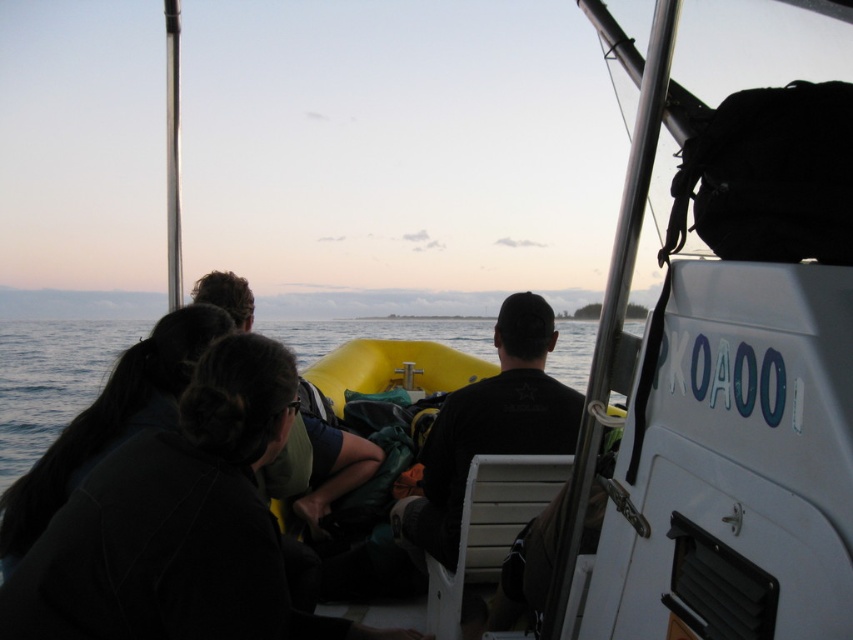
You are standing on the boat and want to take a photo of the black matte shirt at center and the blue water at lower left. Which object should you point your camera towards first if you want to capture both in a single shot?

You should point your camera towards the black matte shirt at center first because the blue water at lower left is to the left of it, so capturing the shirt first will ensure both are in frame.

You are on a boat watching the sunset and see a person wearing a black matte shirt at center and a dark green fabric at center. Which clothing item is nearer to you?

The black matte shirt at center is closer to the viewer than the dark green fabric at center.